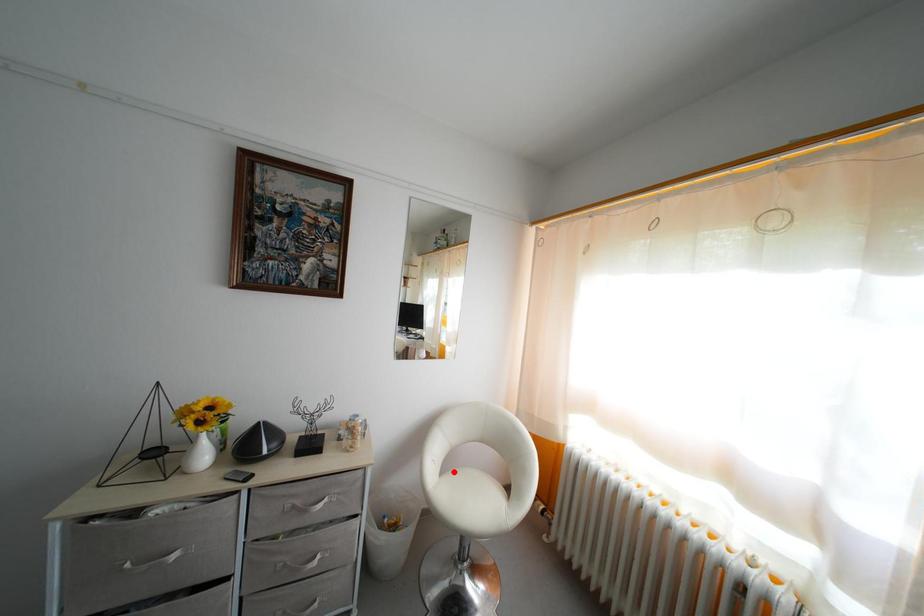
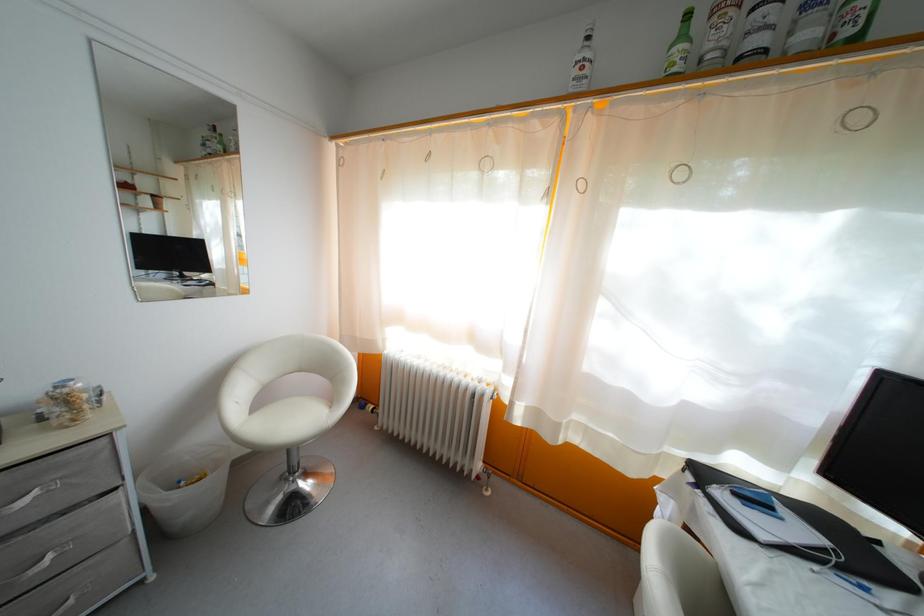
Where in the second image is the point corresponding to the highlighted location from the first image?

(265, 408)